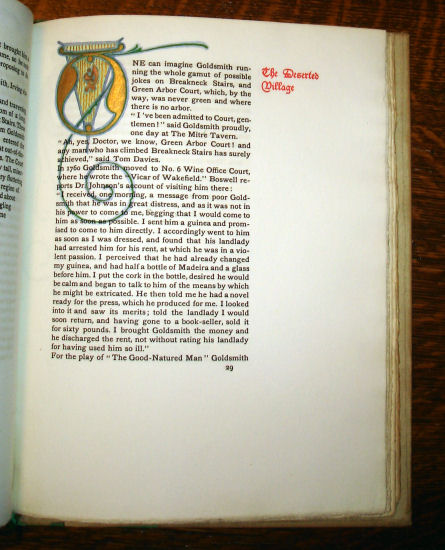
The height and width of the screenshot is (550, 445). Find the location of `book`. book is located at coordinates pos(292,243).